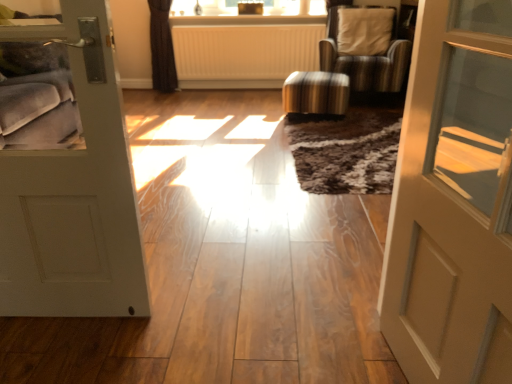
Question: Can you confirm if striped fabric stool at center is bigger than white ribbed radiator at center?

Choices:
 (A) yes
 (B) no

Answer: (B)

Question: Does striped fabric stool at center have a greater width compared to white ribbed radiator at center?

Choices:
 (A) yes
 (B) no

Answer: (A)

Question: Is striped fabric stool at center surrounding white ribbed radiator at center?

Choices:
 (A) no
 (B) yes

Answer: (A)

Question: Is striped fabric stool at center beside white ribbed radiator at center?

Choices:
 (A) yes
 (B) no

Answer: (B)

Question: Can you confirm if striped fabric stool at center is positioned to the right of white ribbed radiator at center?

Choices:
 (A) yes
 (B) no

Answer: (A)

Question: Considering the positions of point (417, 246) and point (304, 99), is point (417, 246) closer or farther from the camera than point (304, 99)?

Choices:
 (A) closer
 (B) farther

Answer: (A)

Question: Is matte beige door at right, marked as the second door in a left-to-right arrangement, taller or shorter than striped fabric stool at center?

Choices:
 (A) tall
 (B) short

Answer: (A)

Question: Is matte beige door at right, marked as the second door in a left-to-right arrangement, inside or outside of striped fabric stool at center?

Choices:
 (A) outside
 (B) inside

Answer: (A)

Question: From the image's perspective, is matte beige door at right, marked as the second door in a left-to-right arrangement, located above or below striped fabric stool at center?

Choices:
 (A) below
 (B) above

Answer: (A)

Question: Considering the positions of striped fabric stool at center and white matte door at left, placed as the second door when sorted from right to left, in the image, is striped fabric stool at center wider or thinner than white matte door at left, placed as the second door when sorted from right to left,?

Choices:
 (A) wide
 (B) thin

Answer: (A)

Question: Is striped fabric stool at center bigger or smaller than white matte door at left, the 1th door viewed from the left?

Choices:
 (A) small
 (B) big

Answer: (B)

Question: Relative to white matte door at left, placed as the second door when sorted from right to left, is striped fabric stool at center in front or behind?

Choices:
 (A) behind
 (B) front

Answer: (A)

Question: From the image's perspective, relative to white matte door at left, the 1th door viewed from the left, is striped fabric stool at center above or below?

Choices:
 (A) above
 (B) below

Answer: (A)

Question: Considering the positions of white ribbed radiator at center and matte beige door at right, marked as the second door in a left-to-right arrangement, in the image, is white ribbed radiator at center wider or thinner than matte beige door at right, marked as the second door in a left-to-right arrangement,?

Choices:
 (A) thin
 (B) wide

Answer: (A)

Question: Is white ribbed radiator at center spatially inside matte beige door at right, marked as the second door in a left-to-right arrangement, or outside of it?

Choices:
 (A) outside
 (B) inside

Answer: (A)